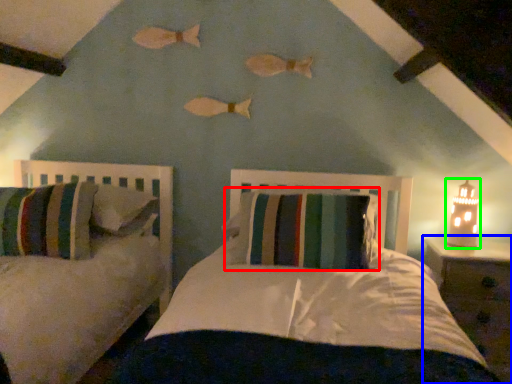
Question: Which object is positioned closest to pillow (highlighted by a red box)? Select from nightstand (highlighted by a blue box) and table lamp (highlighted by a green box).

Choices:
 (A) nightstand
 (B) table lamp

Answer: (A)